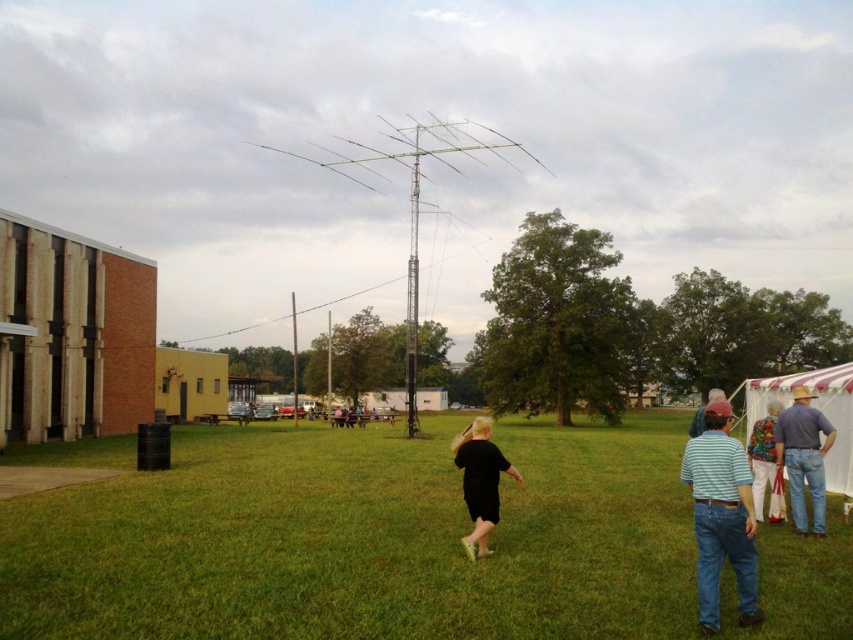
Question: Which point appears farthest from the camera in this image?

Choices:
 (A) (799, 394)
 (B) (695, 448)
 (C) (756, 435)

Answer: (C)

Question: Is white striped tent at lower right thinner than blue striped shirt at center?

Choices:
 (A) yes
 (B) no

Answer: (A)

Question: Is white striped tent at lower right to the left of blue striped shirt at center from the viewer's perspective?

Choices:
 (A) yes
 (B) no

Answer: (A)

Question: Among these points, which one is farthest from the camera?

Choices:
 (A) (619, 449)
 (B) (698, 419)
 (C) (770, 497)

Answer: (A)

Question: Can you confirm if green grass at center is positioned to the left of white striped tent at lower right?

Choices:
 (A) yes
 (B) no

Answer: (A)

Question: Which of these objects is positioned farthest from the white striped tent at lower right?

Choices:
 (A) green grass at center
 (B) blue striped shirt at center
 (C) black matte shirt at center

Answer: (B)